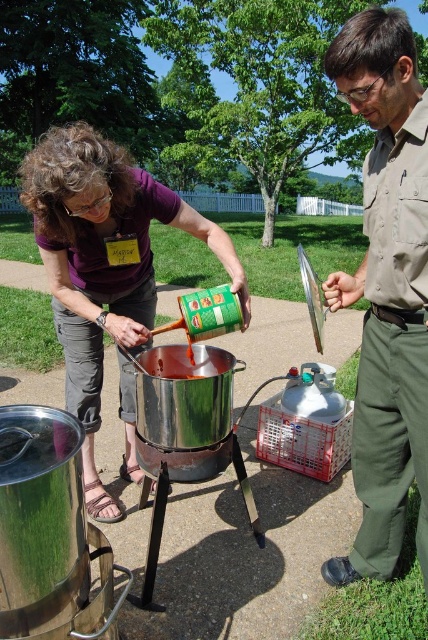
Can you confirm if brown uniform at center is positioned to the right of matte purple shirt at center?

Yes, brown uniform at center is to the right of matte purple shirt at center.

Can you confirm if brown uniform at center is positioned to the left of matte purple shirt at center?

No, brown uniform at center is not to the left of matte purple shirt at center.

Image resolution: width=428 pixels, height=640 pixels. Describe the element at coordinates (386, 291) in the screenshot. I see `brown uniform at center` at that location.

You are a GUI agent. You are given a task and a screenshot of the screen. Output one action in this format:
    pyautogui.click(x=<x>, y=<y>)
    Task: Click on the brown uniform at center
    The height and width of the screenshot is (640, 428).
    Given the screenshot: What is the action you would take?
    pyautogui.click(x=386, y=291)